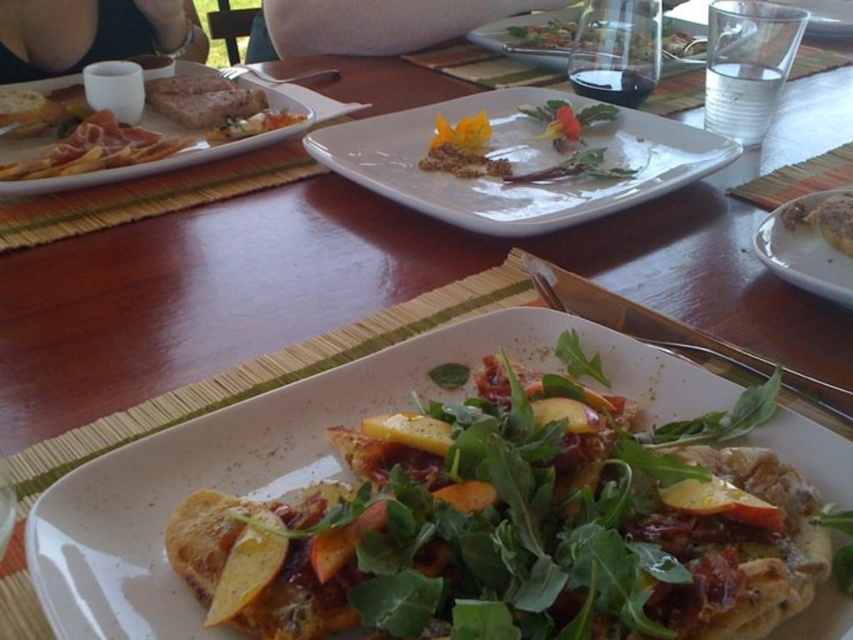
Question: Is white glossy plate at center below white ceramic plate at lower right?

Choices:
 (A) no
 (B) yes

Answer: (A)

Question: Which point is farther to the camera?

Choices:
 (A) clear glass plate at upper center
 (B) brown crumbly bread at right
 (C) matte brown bread at left

Answer: (A)

Question: Is white glossy plate at center bigger than matte white bread at upper left?

Choices:
 (A) yes
 (B) no

Answer: (A)

Question: Which point is farther from the camera taking this photo?

Choices:
 (A) (555, 52)
 (B) (850, 246)
 (C) (601, 116)
 (D) (596, 196)

Answer: (A)

Question: Estimate the real-world distances between objects in this image. Which object is closer to the brown crumbly bread at right?

Choices:
 (A) matte brown pizza at center
 (B) matte brown crumb at center
 (C) white ceramic plate at lower right

Answer: (C)

Question: Can you confirm if matte brown crumb at center is thinner than matte brown pizza at center?

Choices:
 (A) yes
 (B) no

Answer: (B)